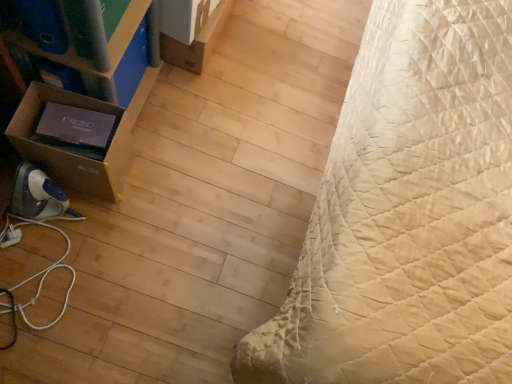
Question: In the image, is matte cardboard box at left positioned in front of or behind brown cardboard box at upper left, the 1th cardboard box when ordered from back to front?

Choices:
 (A) front
 (B) behind

Answer: (A)

Question: In terms of width, does matte cardboard box at left look wider or thinner when compared to brown cardboard box at upper left, the second cardboard box from the left?

Choices:
 (A) wide
 (B) thin

Answer: (A)

Question: Which object is the farthest from the brown cardboard box at left, which appears as the 1th cardboard box when viewed from the left?

Choices:
 (A) matte cardboard box at left
 (B) beige quilted bed at right
 (C) brown cardboard box at upper left, arranged as the 2th cardboard box when ordered from the bottom

Answer: (B)

Question: Considering the real-world distances, which object is farthest from the brown cardboard box at left, acting as the second cardboard box starting from the top?

Choices:
 (A) matte cardboard box at left
 (B) brown cardboard box at upper left, the 1th cardboard box when ordered from back to front
 (C) beige quilted bed at right

Answer: (C)